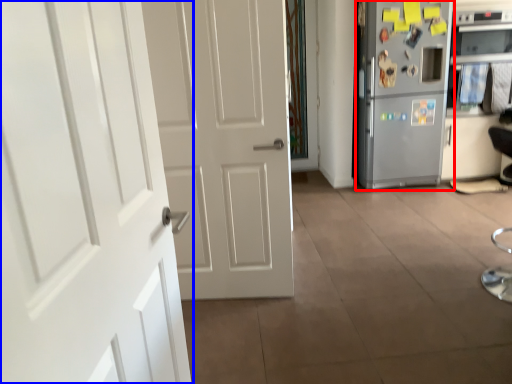
Question: Among these objects, which one is nearest to the camera, refrigerator (highlighted by a red box) or door (highlighted by a blue box)?

Choices:
 (A) refrigerator
 (B) door

Answer: (B)